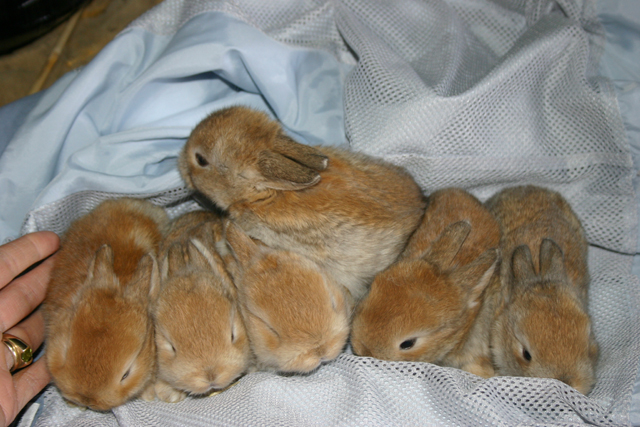
The width and height of the screenshot is (640, 427). Find the location of `mattress`. mattress is located at coordinates click(96, 35).